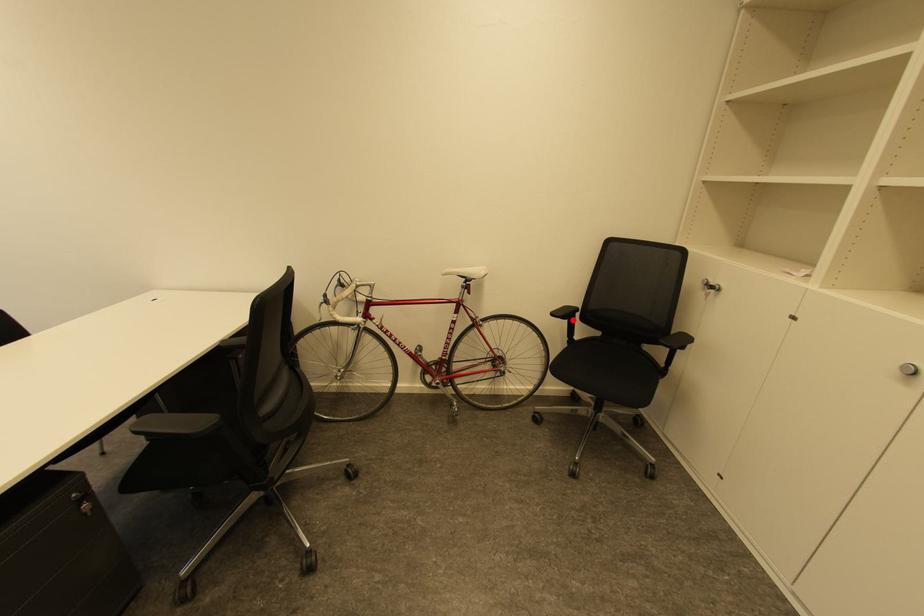
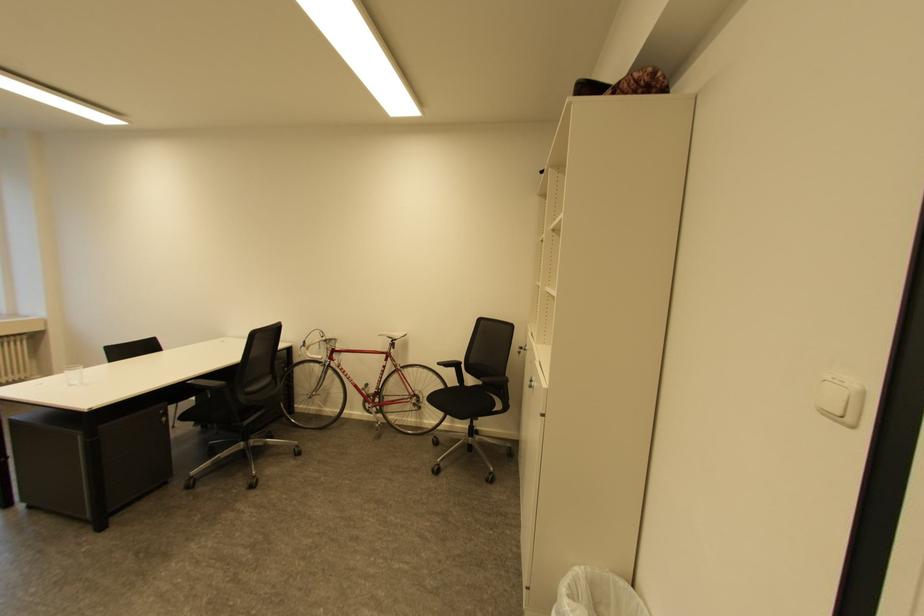
In the second image, find the point that corresponds to the highlighted location in the first image.

(459, 370)